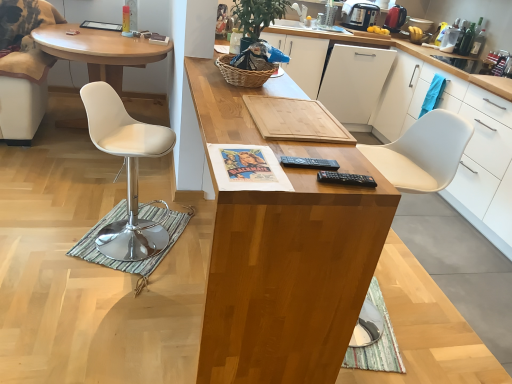
Where is `black plastic remote control at center, which appears as the first remote control when viewed from the top`? The height and width of the screenshot is (384, 512). black plastic remote control at center, which appears as the first remote control when viewed from the top is located at coordinates (309, 163).

Find the location of a particular element. The width and height of the screenshot is (512, 384). white matte drawer at upper right is located at coordinates (418, 98).

This screenshot has width=512, height=384. I want to click on metallic silver coffee maker at upper right, so click(x=359, y=14).

In order to face white matte cabinet at right, which is the 2th cabinetry in left-to-right order, should I rotate leftwards or rightwards?

Turn right by 23.531 degrees to look at white matte cabinet at right, which is the 2th cabinetry in left-to-right order.

You are a GUI agent. You are given a task and a screenshot of the screen. Output one action in this format:
    pyautogui.click(x=<x>, y=<y>)
    Task: Click on the black plastic remote control at center, which appears as the first remote control when viewed from the top
    The image size is (512, 384).
    Given the screenshot: What is the action you would take?
    pyautogui.click(x=309, y=163)

Is wooden at center, marked as the 1th desk in a front-to-back arrangement, shorter than metallic silver coffee maker at upper right?

No.

Does wooden at center, acting as the second desk starting from the left, contain metallic silver coffee maker at upper right?

Definitely not — metallic silver coffee maker at upper right is not inside wooden at center, acting as the second desk starting from the left.

Is point (212, 260) positioned in front of point (364, 1)?

Yes, it is in front of point (364, 1).

Between wooden at center, acting as the second desk starting from the left, and metallic silver coffee maker at upper right, which one has smaller width?

metallic silver coffee maker at upper right.

Considering the points (501, 205) and (451, 96), which point is in front, point (501, 205) or point (451, 96)?

Positioned in front is point (501, 205).

In the scene shown: Is wooden cutting board at center, which is the 1th cabinetry from left to right, not near white matte drawer at upper right?

No, wooden cutting board at center, which is the 1th cabinetry from left to right, is not far from white matte drawer at upper right.

From a real-world perspective, is wooden cutting board at center, which appears as the second cabinetry when viewed from the right, above or below white matte drawer at upper right?

wooden cutting board at center, which appears as the second cabinetry when viewed from the right, is situated lower than white matte drawer at upper right in the real world.

Is the position of wooden cutting board at center, which is the 1th cabinetry from left to right, more distant than that of white matte drawer at upper right?

No, the depth of wooden cutting board at center, which is the 1th cabinetry from left to right, is less than that of white matte drawer at upper right.

Based on the photo, relative to green woven basket at upper center, is metallic red kettle at upper right in front or behind?

In the image, metallic red kettle at upper right appears behind green woven basket at upper center.

Is metallic red kettle at upper right inside or outside of green woven basket at upper center?

The correct answer is: outside.

From the image's perspective, which is below, metallic red kettle at upper right or green woven basket at upper center?

From the image's view, green woven basket at upper center is below.

Does metallic red kettle at upper right have a smaller size compared to green woven basket at upper center?

Correct, metallic red kettle at upper right occupies less space than green woven basket at upper center.

Is wooden cutting board at center, which appears as the second cabinetry when viewed from the right, next to black plastic remote control at right, marked as the first remote control in a bottom-to-top arrangement?

wooden cutting board at center, which appears as the second cabinetry when viewed from the right, is not next to black plastic remote control at right, marked as the first remote control in a bottom-to-top arrangement, and they're not touching.

Is wooden cutting board at center, which appears as the second cabinetry when viewed from the right, wider or thinner than black plastic remote control at right, which ranks as the 2th remote control in top-to-bottom order?

Considering their sizes, wooden cutting board at center, which appears as the second cabinetry when viewed from the right, looks broader than black plastic remote control at right, which ranks as the 2th remote control in top-to-bottom order.

Is wooden cutting board at center, which appears as the second cabinetry when viewed from the right, situated inside black plastic remote control at right, which ranks as the 2th remote control in top-to-bottom order, or outside?

wooden cutting board at center, which appears as the second cabinetry when viewed from the right, is outside black plastic remote control at right, which ranks as the 2th remote control in top-to-bottom order.

In terms of height, does wooden cutting board at center, which is the 1th cabinetry from left to right, look taller or shorter compared to black plastic remote control at right, which ranks as the 2th remote control in top-to-bottom order?

In the image, wooden cutting board at center, which is the 1th cabinetry from left to right, appears to be taller than black plastic remote control at right, which ranks as the 2th remote control in top-to-bottom order.

From the picture: From a real-world perspective, which object rests below the other?

white leather chair at left.

Which of these two, metallic red kettle at upper right or white leather chair at left, stands taller?

white leather chair at left is taller.

Is metallic red kettle at upper right further to camera compared to white leather chair at left?

That is True.

From the image's perspective, between woven brown picnic basket at center and wooden cutting board at center, which appears as the second cabinetry when viewed from the right, which one is located above?

wooden cutting board at center, which appears as the second cabinetry when viewed from the right, from the image's perspective.

Do you think woven brown picnic basket at center is within wooden cutting board at center, which is the 1th cabinetry from left to right, or outside of it?

woven brown picnic basket at center exists outside the volume of wooden cutting board at center, which is the 1th cabinetry from left to right.

Is woven brown picnic basket at center placed right next to wooden cutting board at center, which is the 1th cabinetry from left to right?

woven brown picnic basket at center is not next to wooden cutting board at center, which is the 1th cabinetry from left to right, and they're not touching.

Which object is positioned more to the right, woven brown picnic basket at center or wooden cutting board at center, which is the 1th cabinetry from left to right?

wooden cutting board at center, which is the 1th cabinetry from left to right.

Measure the distance between black plastic remote control at center, which appears as the first remote control when viewed from the top, and green woven basket at upper center.

black plastic remote control at center, which appears as the first remote control when viewed from the top, is 3.89 feet away from green woven basket at upper center.

Considering the relative sizes of black plastic remote control at center, which appears as the first remote control when viewed from the top, and green woven basket at upper center in the image provided, is black plastic remote control at center, which appears as the first remote control when viewed from the top, wider than green woven basket at upper center?

In fact, black plastic remote control at center, which appears as the first remote control when viewed from the top, might be narrower than green woven basket at upper center.

Considering the sizes of black plastic remote control at center, which appears as the first remote control when viewed from the top, and green woven basket at upper center in the image, is black plastic remote control at center, which appears as the first remote control when viewed from the top, bigger or smaller than green woven basket at upper center?

Considering their sizes, black plastic remote control at center, which appears as the first remote control when viewed from the top, takes up less space than green woven basket at upper center.

Considering the relative positions of black plastic remote control at center, marked as the 2th remote control in a bottom-to-top arrangement, and green woven basket at upper center in the image provided, is black plastic remote control at center, marked as the 2th remote control in a bottom-to-top arrangement, to the left of green woven basket at upper center from the viewer's perspective?

In fact, black plastic remote control at center, marked as the 2th remote control in a bottom-to-top arrangement, is to the right of green woven basket at upper center.

Identify the location of desk that is the 2nd one when counting downward from the metallic silver coffee maker at upper right (from the image's perspective). (284, 253).

Identify the location of the 1st cabinetry directly beneath the white matte drawer at upper right (from a real-world perspective). This screenshot has height=384, width=512. (472, 137).

Based on their spatial positions, is white matte cabinet at right, which is the 2th cabinetry in left-to-right order, or metallic silver coffee maker at upper right further from wooden cutting board at center, which is the 1th cabinetry from left to right?

metallic silver coffee maker at upper right.

Which object lies further to the anchor point white matte drawer at upper right, metallic silver coffee maker at upper right or wooden cutting board at center, which is the 1th cabinetry from left to right?

Based on the image, metallic silver coffee maker at upper right appears to be further to white matte drawer at upper right.

Looking at the image, which one is located further to white matte cabinet at right, the 1th cabinetry viewed from the right, white leather chair at left or green woven basket at upper center?

white leather chair at left.

When comparing their distances from white matte dishwasher at center, does white matte cabinet at right, the 1th cabinetry viewed from the right, or metallic red kettle at upper right seem further?

metallic red kettle at upper right is further to white matte dishwasher at center.

Based on their spatial positions, is wooden at center, acting as the second desk starting from the back, or metallic silver coffee maker at upper right further from woven brown picnic basket at center?

metallic silver coffee maker at upper right is further to woven brown picnic basket at center.

Based on their spatial positions, is white leather chair at left or wooden cutting board at center, which is the 1th cabinetry from left to right, closer to green striped mat at lower left?

white leather chair at left.

When comparing their distances from white matte cabinet at right, the 1th cabinetry viewed from the right, does black plastic remote control at center, which appears as the first remote control when viewed from the top, or metallic red kettle at upper right seem further?

Result: black plastic remote control at center, which appears as the first remote control when viewed from the top, is positioned further to the anchor white matte cabinet at right, the 1th cabinetry viewed from the right.

From the picture: When comparing their distances from white matte cabinet at right, the 1th cabinetry viewed from the right, does white leather desk at left, arranged as the 1th desk when viewed from the back, or white leather chair at left seem closer?

white leather chair at left is closer to white matte cabinet at right, the 1th cabinetry viewed from the right.

Find the location of a particular element. The height and width of the screenshot is (384, 512). cabinetry between wooden cutting board at center, which is the 1th cabinetry from left to right, and white matte dishwasher at center in the front-back direction is located at coordinates (466, 147).

The width and height of the screenshot is (512, 384). Find the location of `mat between wooden at center, acting as the second desk starting from the left, and white leather desk at left, the 1th desk viewed from the left, from front to back`. mat between wooden at center, acting as the second desk starting from the left, and white leather desk at left, the 1th desk viewed from the left, from front to back is located at coordinates (124, 219).

The width and height of the screenshot is (512, 384). I want to click on chair located between black plastic remote control at center, marked as the 2th remote control in a bottom-to-top arrangement, and white matte dishwasher at center in the depth direction, so click(x=127, y=170).

At what (x,y) coordinates should I click in order to perform the action: click on drawer situated between white leather chair at left and white matte cabinet at right, which is the 2th cabinetry in left-to-right order, from left to right. Please return your answer as a coordinate pair (x, y). The width and height of the screenshot is (512, 384). Looking at the image, I should click on (418, 98).